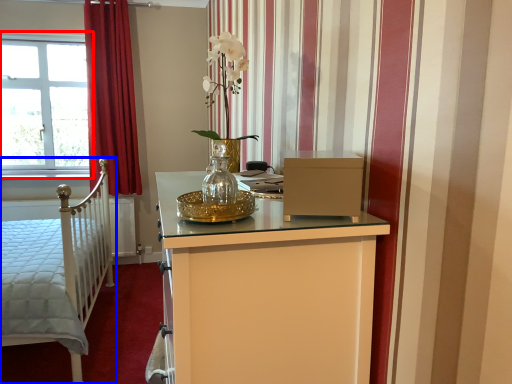
Question: Which object appears closest to the camera in this image, window (highlighted by a red box) or bed (highlighted by a blue box)?

Choices:
 (A) window
 (B) bed

Answer: (B)